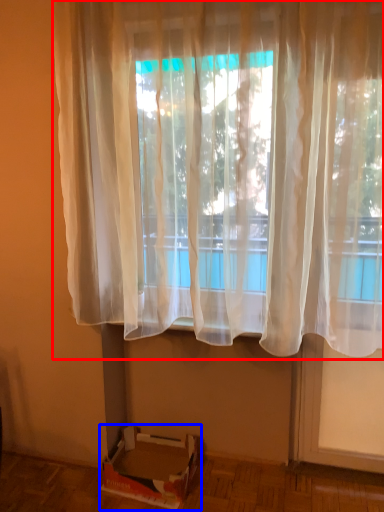
Question: Which point is further to the camera, curtain (highlighted by a red box) or cardboard box (highlighted by a blue box)?

Choices:
 (A) curtain
 (B) cardboard box

Answer: (B)